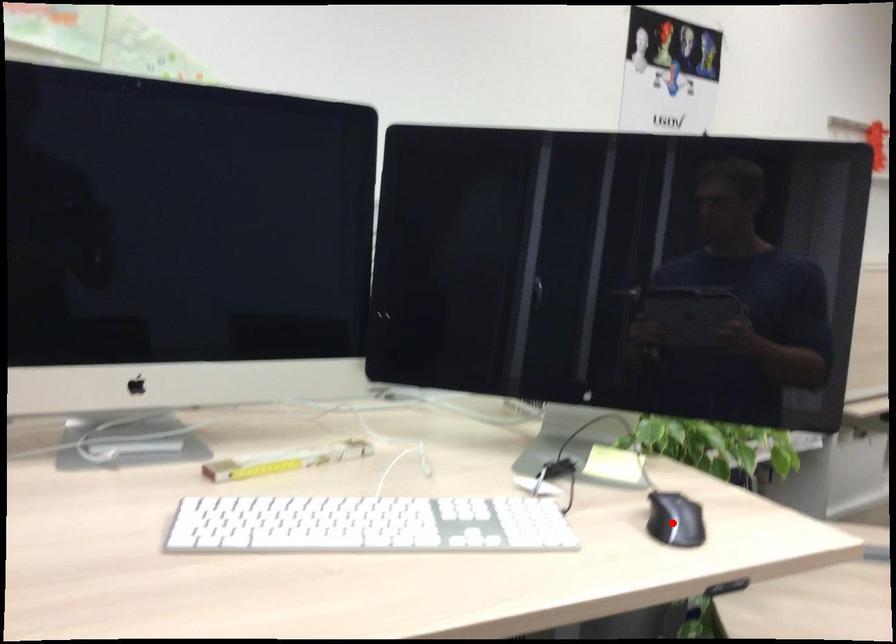
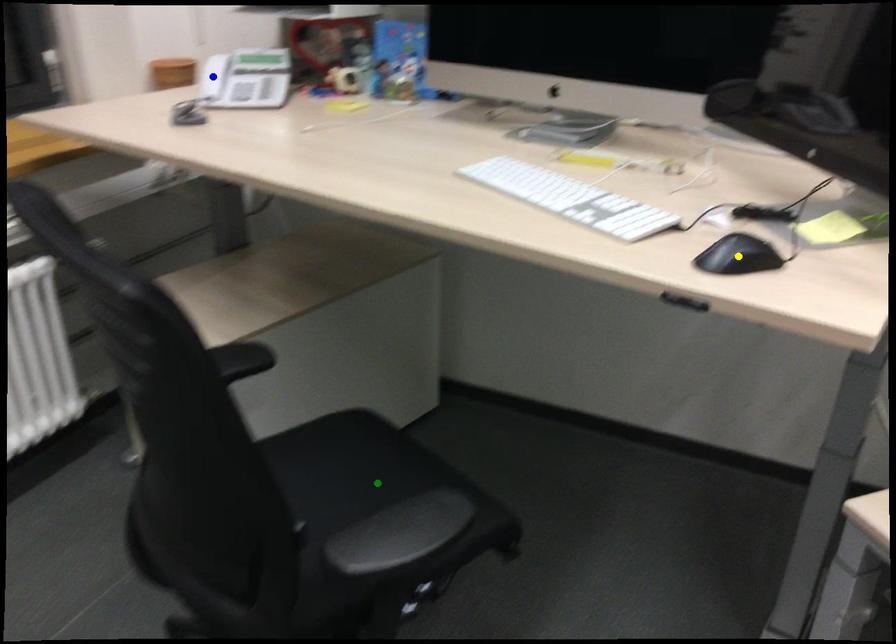
Question: I am providing you with two images of the same scene from different viewpoints. A red point is marked on the first image. You are given multiple points on the second image. Which point in image 2 is actually the same real-world point as the red point in image 1?

Choices:
 (A) blue point
 (B) green point
 (C) yellow point

Answer: (C)